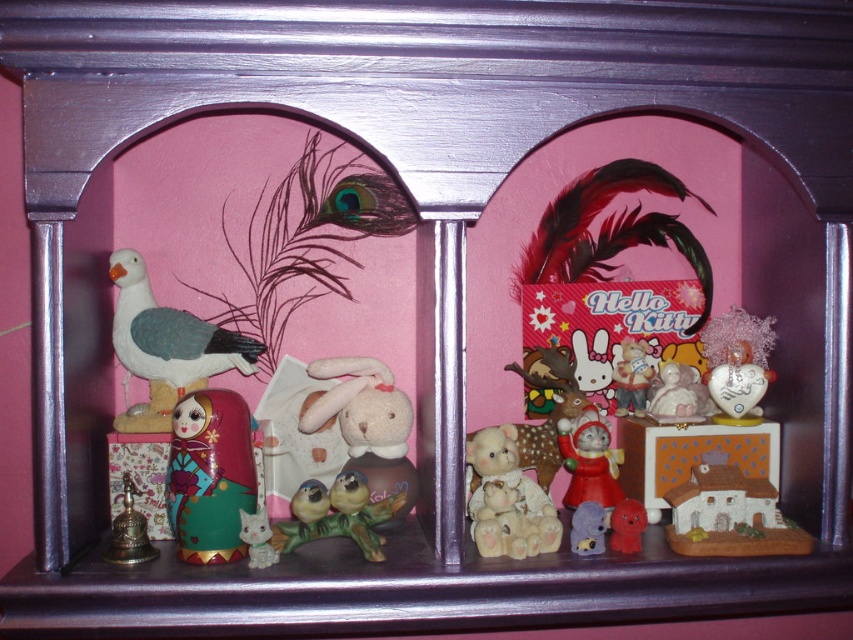
Is point (358, 269) positioned after point (399, 493)?

Yes, it is.

Is matte ceramic figurines at center to the right of porcelain birds at center from the viewer's perspective?

Indeed, matte ceramic figurines at center is positioned on the right side of porcelain birds at center.

You are a GUI agent. You are given a task and a screenshot of the screen. Output one action in this format:
    pyautogui.click(x=<x>, y=<y>)
    Task: Click on the matte ceramic figurines at center
    
    Given the screenshot: What is the action you would take?
    pyautogui.click(x=593, y=234)

Does porcelain birds at center have a lesser width compared to matte plastic hello kitty doll at center?

Incorrect, porcelain birds at center's width is not less than matte plastic hello kitty doll at center's.

Which is behind, point (376, 513) or point (637, 390)?

Positioned behind is point (637, 390).

Is point (299, 531) in front of point (631, 369)?

Yes, it is in front of point (631, 369).

Where is `porcelain birds at center`? This screenshot has width=853, height=640. porcelain birds at center is located at coordinates 337,515.

Consider the image. Does matte plastic cat at center appear on the left side of matte plastic hello kitty doll at center?

Yes, matte plastic cat at center is to the left of matte plastic hello kitty doll at center.

Between matte plastic cat at center and matte plastic hello kitty doll at center, which one appears on the right side from the viewer's perspective?

Positioned to the right is matte plastic hello kitty doll at center.

Is point (608, 492) positioned after point (625, 348)?

That is False.

The height and width of the screenshot is (640, 853). I want to click on matte plastic cat at center, so click(589, 460).